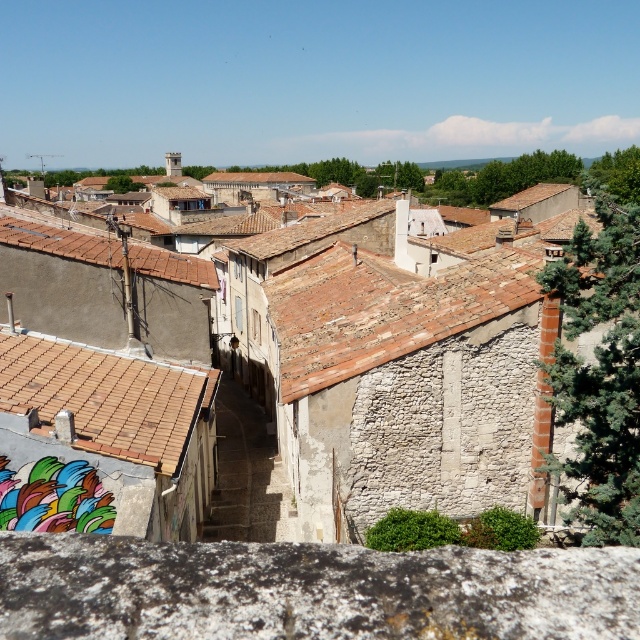
Based on the scene description, where is the rustic stone buildings at center located in terms of their 2D coordinates?

The rustic stone buildings at center are located at the 2D coordinates point (397, 362).

You are standing on a balcony and looking at the rustic stone buildings at center and the brown tile roof at left. Which one is higher from your viewpoint?

The rustic stone buildings at center is above the brown tile roof at left, so it is higher from your viewpoint.

You are a photographer planning to capture the entire scene of the rustic stone buildings at center and the brown tiled roof at lower left in a single shot. Based on their widths, which object would require you to adjust your camera angle more to ensure both are fully visible?

The rustic stone buildings at center would require adjusting the camera angle more because their width surpasses that of the brown tiled roof at lower left, making it necessary to widen the frame to include both objects fully.